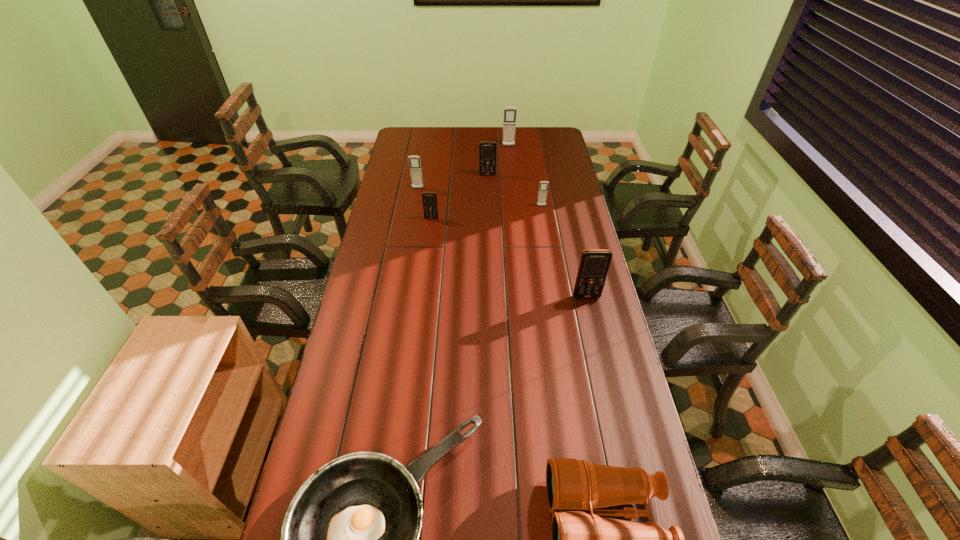
Locate which cellular telephone is the third closest to the sixth nearest object. Please provide its 2D coordinates. Your answer should be formatted as a tuple, i.e. [(x, y)], where the tuple contains the x and y coordinates of a point satisfying the conditions above.

[(543, 187)]

Identify which cellular telephone is the nearest to the third nearest object. Please provide its 2D coordinates. Your answer should be formatted as a tuple, i.e. [(x, y)], where the tuple contains the x and y coordinates of a point satisfying the conditions above.

[(543, 187)]

Select which gray cellular telephone is the third closest to the second nearest cellular telephone. Please provide its 2D coordinates. Your answer should be formatted as a tuple, i.e. [(x, y)], where the tuple contains the x and y coordinates of a point satisfying the conditions above.

[(509, 124)]

At what (x,y) coordinates should I click in order to perform the action: click on gray cellular telephone object that ranks as the second closest to the red frying pan. Please return your answer as a coordinate pair (x, y). The height and width of the screenshot is (540, 960). Looking at the image, I should click on (414, 161).

At what (x,y) coordinates should I click in order to perform the action: click on orange cellular telephone that can be found as the second closest to the binoculars. Please return your answer as a coordinate pair (x, y). The image size is (960, 540). Looking at the image, I should click on (430, 208).

Select which orange cellular telephone is the closest to the nearest orange cellular telephone. Please provide its 2D coordinates. Your answer should be formatted as a tuple, i.e. [(x, y)], where the tuple contains the x and y coordinates of a point satisfying the conditions above.

[(430, 208)]